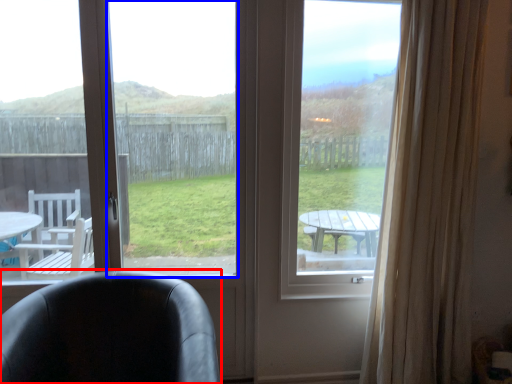
Question: Which object is closer to the camera taking this photo, chair (highlighted by a red box) or window screen (highlighted by a blue box)?

Choices:
 (A) chair
 (B) window screen

Answer: (A)